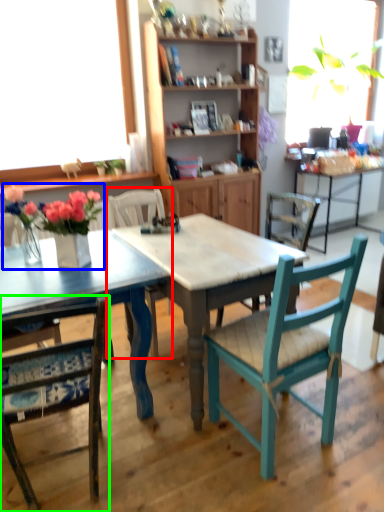
Question: Estimate the real-world distances between objects in this image. Which object is closer to chair (highlighted by a red box), floral arrangement (highlighted by a blue box) or chair (highlighted by a green box)?

Choices:
 (A) floral arrangement
 (B) chair

Answer: (A)